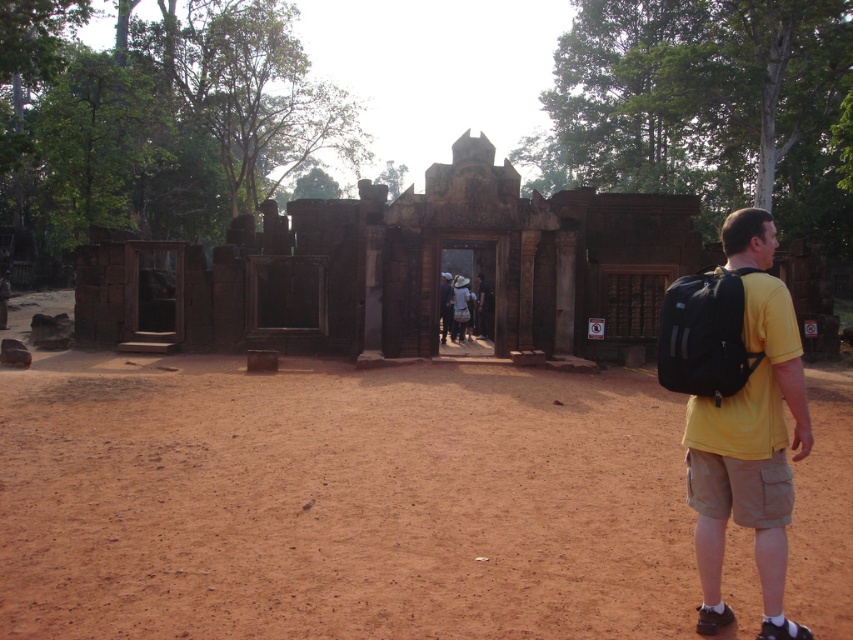
Question: Which object is positioned farthest from the yellow t-shirt at center?

Choices:
 (A) brown stone ruins at center
 (B) yellow cotton shirt at right

Answer: (B)

Question: Does brown sandy dirt track at center appear on the left side of brown stone ruins at center?

Choices:
 (A) yes
 (B) no

Answer: (A)

Question: Which point appears farthest from the camera in this image?

Choices:
 (A) (730, 348)
 (B) (47, 531)

Answer: (B)

Question: In this image, where is brown sandy dirt track at center located relative to black fabric backpack at right?

Choices:
 (A) above
 (B) below

Answer: (B)

Question: Is yellow cotton shirt at right positioned in front of yellow t-shirt at center?

Choices:
 (A) no
 (B) yes

Answer: (B)

Question: Which of these objects is positioned closest to the black fabric backpack at right?

Choices:
 (A) yellow t-shirt at center
 (B) brown sandy dirt track at center
 (C) brown stone ruins at center

Answer: (B)